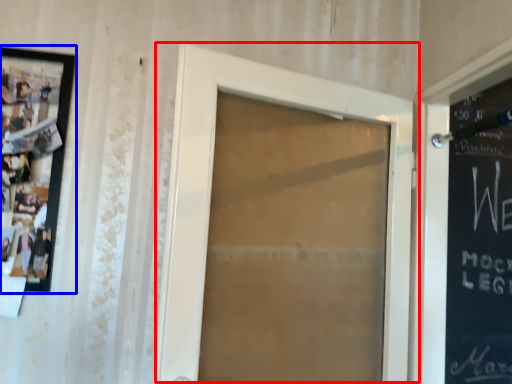
Question: Which object is closer to the camera taking this photo, door (highlighted by a red box) or picture frame (highlighted by a blue box)?

Choices:
 (A) door
 (B) picture frame

Answer: (A)